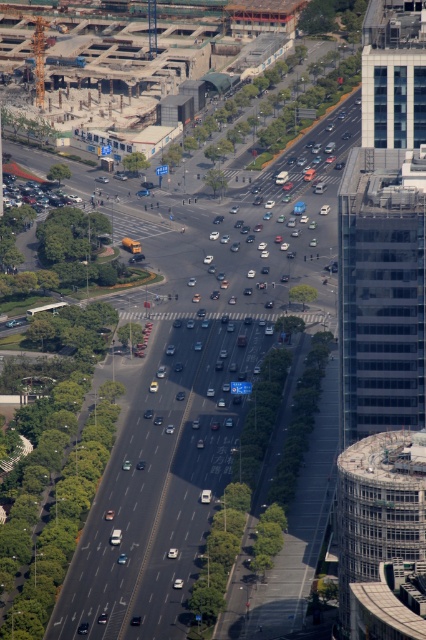
Does transparent glass skyscraper at right have a greater width compared to matte black car at left?

Yes.

Is transparent glass skyscraper at right taller than matte black car at left?

Indeed, transparent glass skyscraper at right has a greater height compared to matte black car at left.

This screenshot has width=426, height=640. I want to click on transparent glass skyscraper at right, so click(380, 292).

Does concrete textured building at right appear under glassy blue skyscraper at upper right?

Yes, concrete textured building at right is below glassy blue skyscraper at upper right.

Is the position of concrete textured building at right more distant than that of glassy blue skyscraper at upper right?

No, concrete textured building at right is closer to the viewer.

Is point (353, 509) farther from viewer compared to point (394, 3)?

No, (353, 509) is in front of (394, 3).

Find the location of a particular element. The width and height of the screenshot is (426, 640). concrete textured building at right is located at coordinates (382, 536).

Between transparent glass skyscraper at right and glassy blue skyscraper at upper right, which one has less height?

glassy blue skyscraper at upper right

Between transparent glass skyscraper at right and glassy blue skyscraper at upper right, which one is positioned lower?

transparent glass skyscraper at right

Who is more distant from viewer, (362, 214) or (386, 97)?

The point (386, 97) is more distant.

Locate an element on the screen. This screenshot has height=640, width=426. transparent glass skyscraper at right is located at coordinates (380, 292).